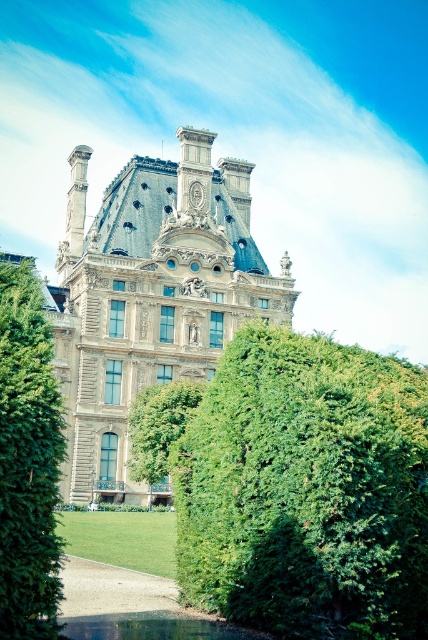
Question: Can you confirm if green leafy bush at center is wider than green leafy tree at left?

Choices:
 (A) yes
 (B) no

Answer: (A)

Question: Which object appears farthest from the camera in this image?

Choices:
 (A) green leafy bush at center
 (B) green grassy pond at lower center
 (C) green leafy tree at center
 (D) green leafy tree at left

Answer: (C)

Question: Where is green leafy tree at left located in relation to green leafy tree at center in the image?

Choices:
 (A) above
 (B) below

Answer: (A)

Question: Estimate the real-world distances between objects in this image. Which object is closer to the green leafy tree at left?

Choices:
 (A) green leafy bush at center
 (B) green leafy tree at center

Answer: (A)

Question: Where is green leafy tree at center located in relation to green grassy pond at lower center in the image?

Choices:
 (A) below
 (B) above

Answer: (B)

Question: Estimate the real-world distances between objects in this image. Which object is closer to the green grassy pond at lower center?

Choices:
 (A) green leafy tree at left
 (B) green leafy tree at center
 (C) green leafy bush at center

Answer: (A)